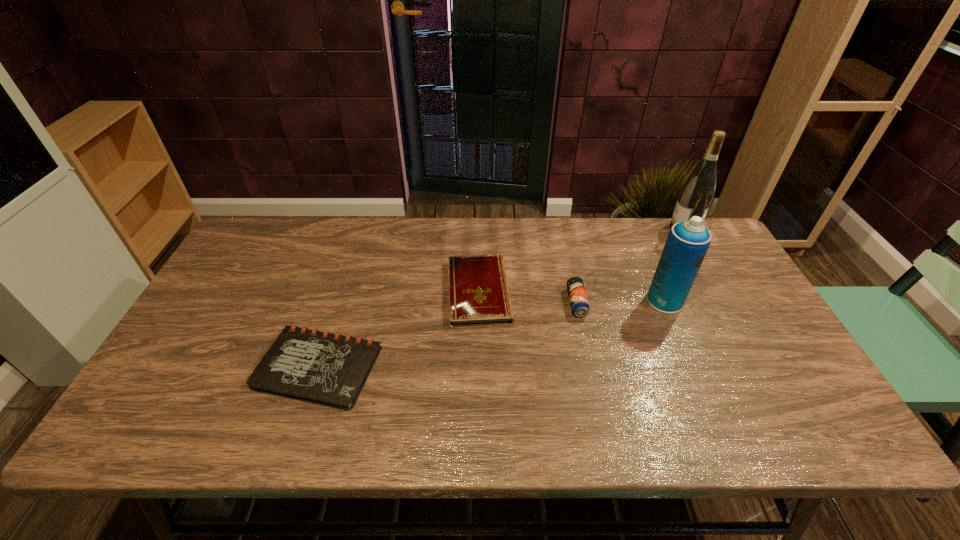
Find the location of a particular element. The height and width of the screenshot is (540, 960). wine bottle is located at coordinates (696, 195).

Where is `the farthest object`? The image size is (960, 540). the farthest object is located at coordinates (696, 195).

Identify the location of the fourth object from left to right. The image size is (960, 540). (687, 243).

Find the location of a particular element. Image resolution: width=960 pixels, height=540 pixels. the second tallest object is located at coordinates (687, 243).

Locate an element on the screen. Image resolution: width=960 pixels, height=540 pixels. the third object from right to left is located at coordinates (579, 303).

At what (x,y) coordinates should I click in order to perform the action: click on the third tallest object. Please return your answer as a coordinate pair (x, y). Looking at the image, I should click on (579, 303).

This screenshot has width=960, height=540. I want to click on the nearer notebook, so click(x=329, y=369).

Where is `the nearest object`? The image size is (960, 540). the nearest object is located at coordinates (329, 369).

The width and height of the screenshot is (960, 540). Identify the location of the second object from left to right. (479, 295).

Find the location of a particular element. The height and width of the screenshot is (540, 960). the right notebook is located at coordinates tap(479, 295).